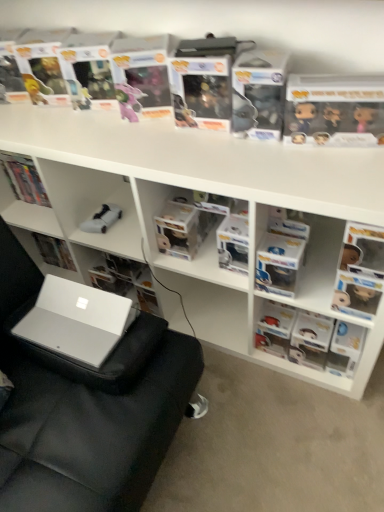
You are a GUI agent. You are given a task and a screenshot of the screen. Output one action in this format:
    pyautogui.click(x=<x>, y=<y>)
    Task: Click on the blank space above silver metallic laptop at lower left (from a real-world perspective)
    The height and width of the screenshot is (512, 384).
    Given the screenshot: What is the action you would take?
    pyautogui.click(x=84, y=293)